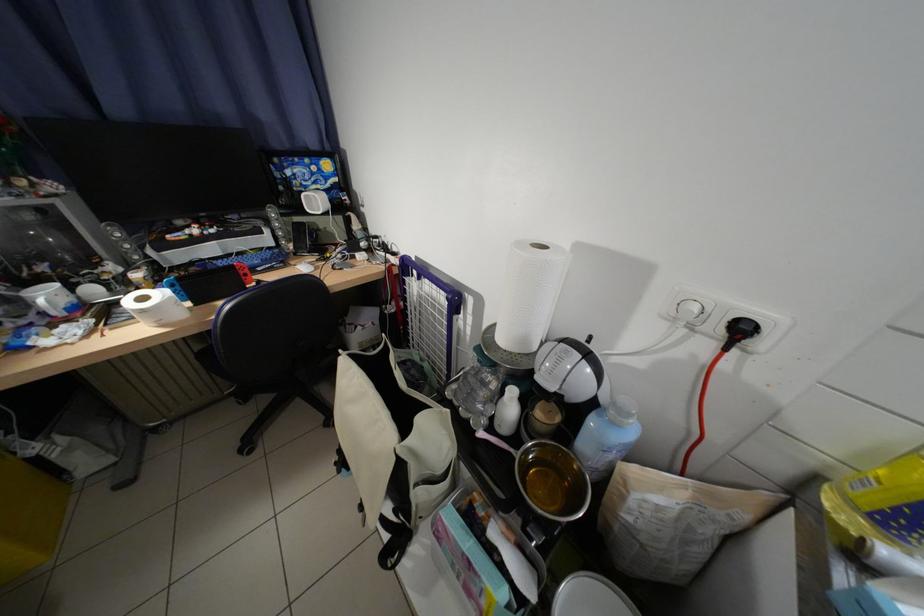
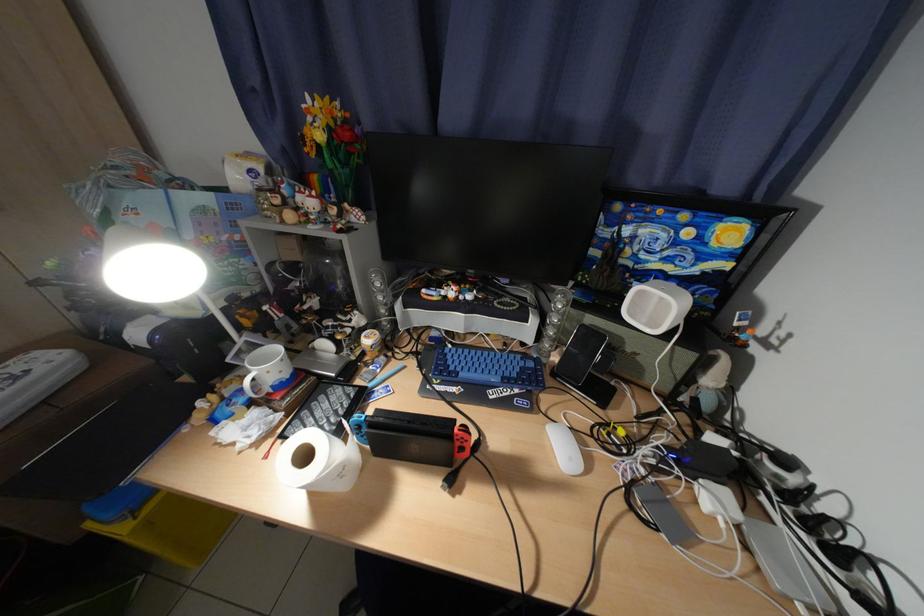
In the second image, find the point that corresponds to (x=285, y=245) in the first image.

(541, 342)